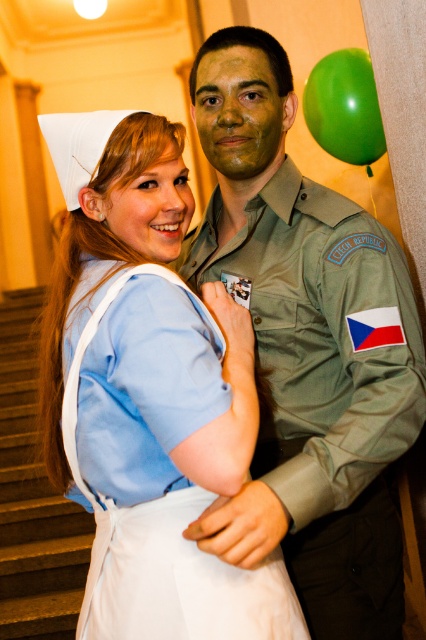
You are organizing a photo shoot and need to ensure that the matte green uniform at center and the green rubber balloon at upper right are visible in the frame. Based on their sizes, which object should you prioritize positioning closer to the camera to avoid being too small in the photo?

The green rubber balloon at upper right is smaller than the matte green uniform at center, so you should prioritize positioning the green rubber balloon at upper right closer to the camera to ensure it appears large enough in the photo.